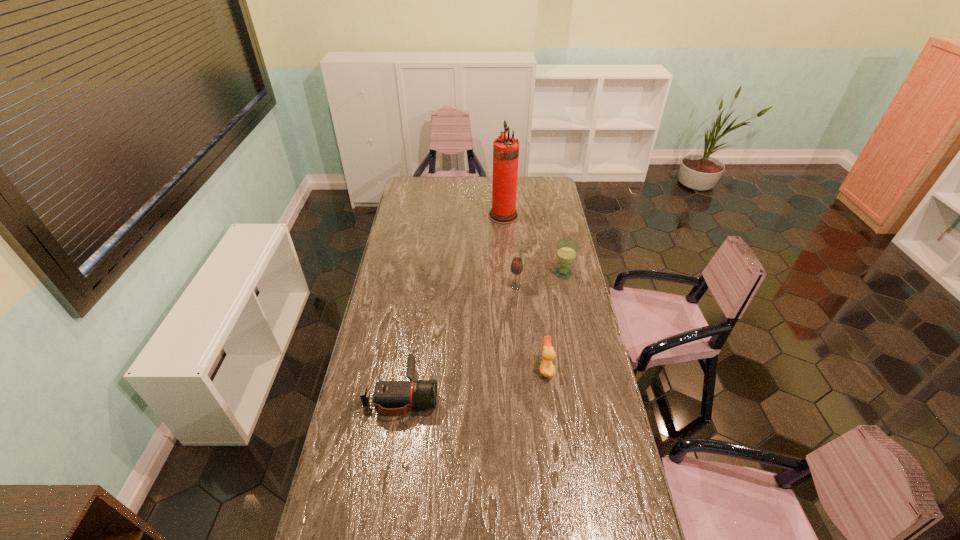
You are a GUI agent. You are given a task and a screenshot of the screen. Output one action in this format:
    pyautogui.click(x=<x>, y=<y>)
    Task: Click on the free spot that satisfies the following two spatial constraints: 1. at the discharge end of the third nearest object; 2. on the left side of the farthest object
    
    Given the screenshot: What is the action you would take?
    pyautogui.click(x=509, y=286)

Locate an element on the screen. The width and height of the screenshot is (960, 540). free space that satisfies the following two spatial constraints: 1. on the front side of the third farthest object; 2. on the lens of the camcorder is located at coordinates (525, 393).